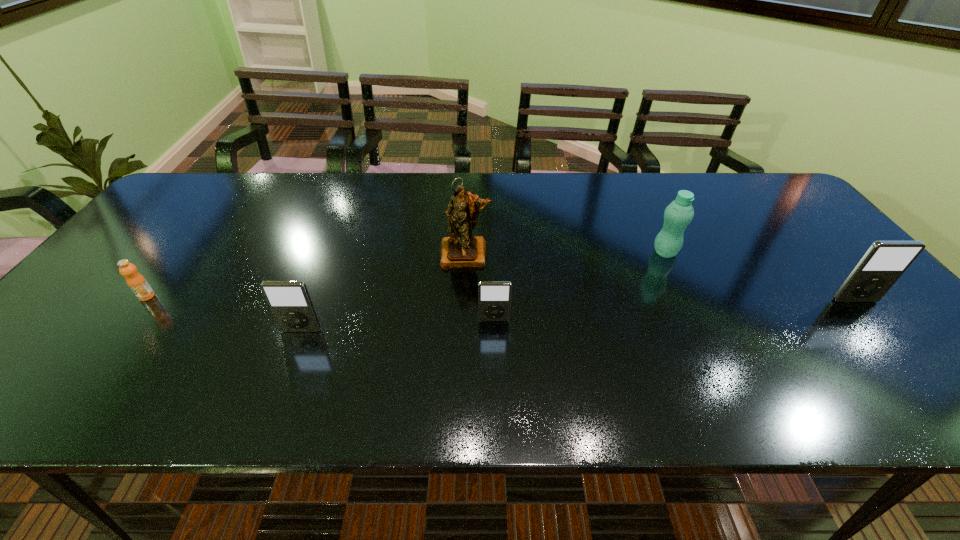
The width and height of the screenshot is (960, 540). What are the coordinates of `free space located 0.070m on the front-facing side of the second nearest iPod` in the screenshot? It's located at (494, 346).

This screenshot has height=540, width=960. I want to click on free space located on the front-facing side of the rightmost object, so click(x=888, y=339).

In order to click on free location located 0.150m on the front label of the orange juice in this screenshot , I will do tap(105, 352).

Find the location of a particular element. The width and height of the screenshot is (960, 540). free space located 0.390m on the left of the bottle is located at coordinates (510, 252).

Where is `free space located on the front-facing side of the tallest object`? The height and width of the screenshot is (540, 960). free space located on the front-facing side of the tallest object is located at coordinates (463, 322).

At what (x,y) coordinates should I click in order to perform the action: click on object located in the left edge section of the desktop. Please return your answer as a coordinate pair (x, y). The image size is (960, 540). Looking at the image, I should click on (137, 283).

Locate an element on the screen. The height and width of the screenshot is (540, 960). object located at the right edge is located at coordinates (884, 262).

The image size is (960, 540). Find the location of `free space at the far edge`. free space at the far edge is located at coordinates (556, 183).

In the image, there is a desktop. At what (x,y) coordinates should I click in order to perform the action: click on free space at the near edge. Please return your answer as a coordinate pair (x, y). The height and width of the screenshot is (540, 960). Looking at the image, I should click on (681, 362).

At what (x,y) coordinates should I click in order to perform the action: click on free space at the left edge. Please return your answer as a coordinate pair (x, y). The height and width of the screenshot is (540, 960). Looking at the image, I should click on (171, 219).